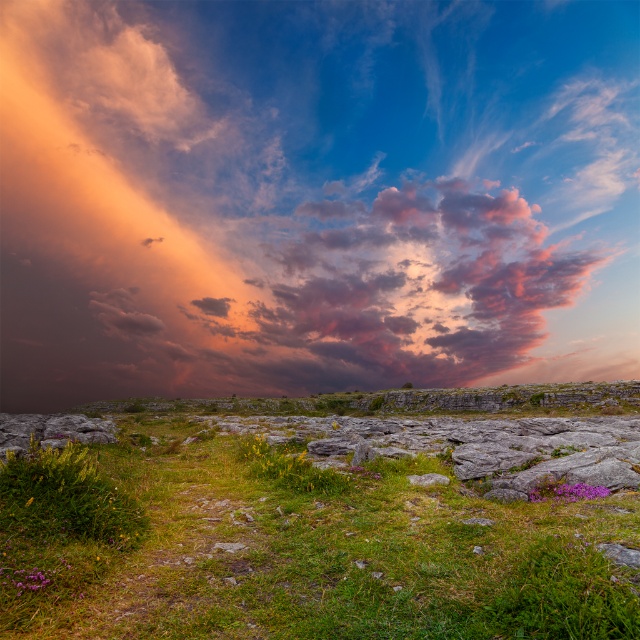
Question: Which of the following is the farthest from the observer?

Choices:
 (A) (560, 483)
 (B) (22, 145)

Answer: (B)

Question: Which of the following is the farthest from the observer?

Choices:
 (A) orange-pink cotton clouds at upper center
 (B) green grassy at lower center

Answer: (A)

Question: Can you confirm if orange-pink cotton clouds at upper center is positioned to the left of purple matte flower at lower right?

Choices:
 (A) yes
 (B) no

Answer: (A)

Question: Which object is closer to the camera taking this photo?

Choices:
 (A) green grassy at lower center
 (B) purple matte flower at lower right

Answer: (A)

Question: Can you confirm if orange-pink cotton clouds at upper center is positioned to the right of purple matte flower at lower right?

Choices:
 (A) yes
 (B) no

Answer: (B)

Question: Is green grassy at lower center behind purple matte flower at lower right?

Choices:
 (A) yes
 (B) no

Answer: (B)